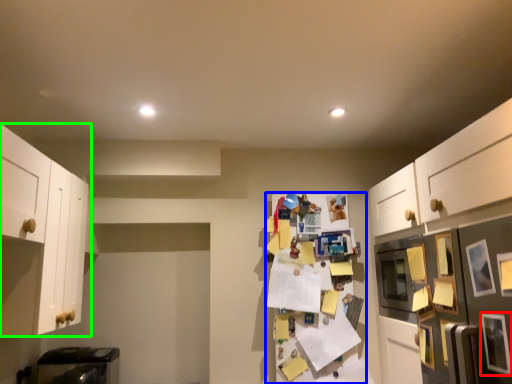
Question: Based on their relative distances, which object is farther from picture frame (highlighted by a red box)? Choose from shelf (highlighted by a blue box) and cabinetry (highlighted by a green box).

Choices:
 (A) shelf
 (B) cabinetry

Answer: (B)